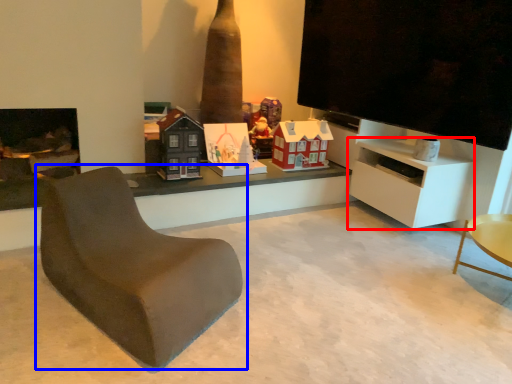
Question: Among these objects, which one is farthest to the camera, cabinetry (highlighted by a red box) or chair (highlighted by a blue box)?

Choices:
 (A) cabinetry
 (B) chair

Answer: (A)